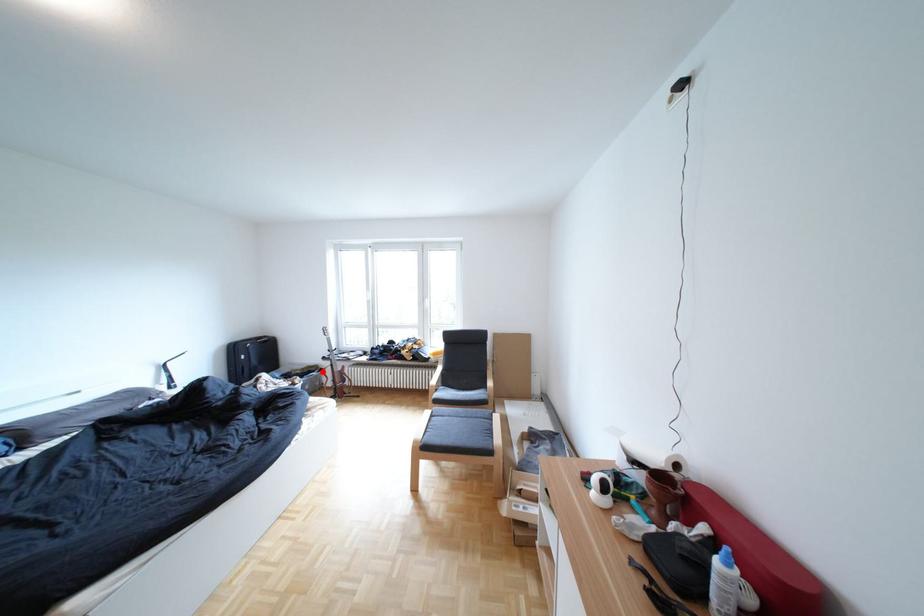
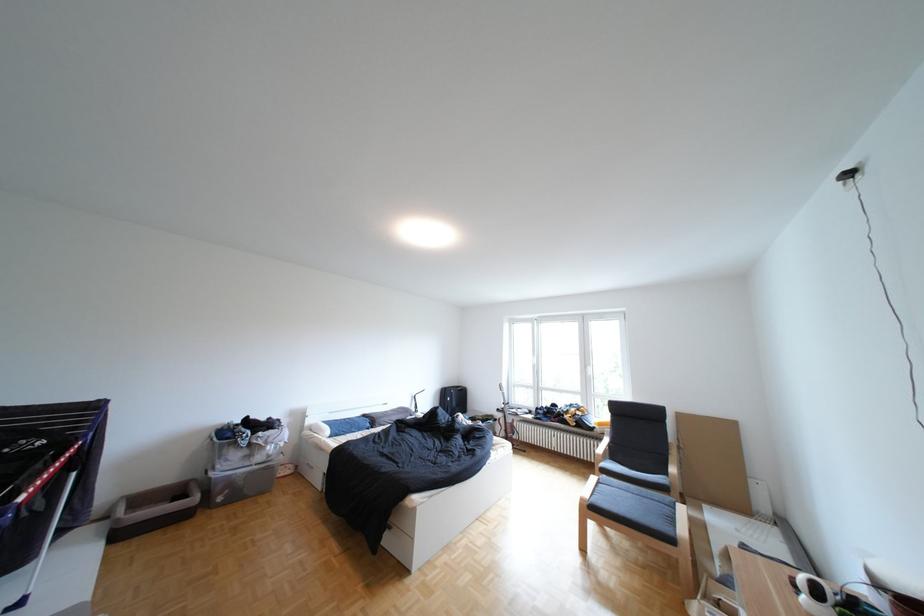
The point at the highlighted location is marked in the first image. Where is the corresponding point in the second image?

(502, 419)